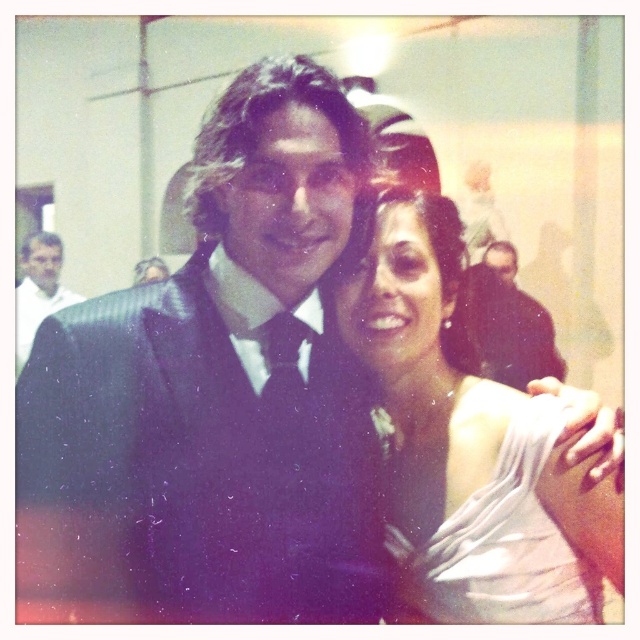
Question: Which object appears closest to the camera in this image?

Choices:
 (A) shiny black suit at left
 (B) satin white dress at center

Answer: (B)

Question: Is silky white dress at center positioned in front of shiny black suit at left?

Choices:
 (A) no
 (B) yes

Answer: (B)

Question: Among these objects, which one is nearest to the camera?

Choices:
 (A) shiny black suit at left
 (B) silky white dress at center
 (C) satin white dress at center

Answer: (C)

Question: Can you confirm if satin white dress at center is smaller than shiny black suit at left?

Choices:
 (A) no
 (B) yes

Answer: (B)

Question: Can you confirm if silky white dress at center is wider than shiny black suit at left?

Choices:
 (A) yes
 (B) no

Answer: (B)

Question: Which object is the farthest from the silky white dress at center?

Choices:
 (A) satin white dress at center
 (B) shiny black suit at left

Answer: (B)